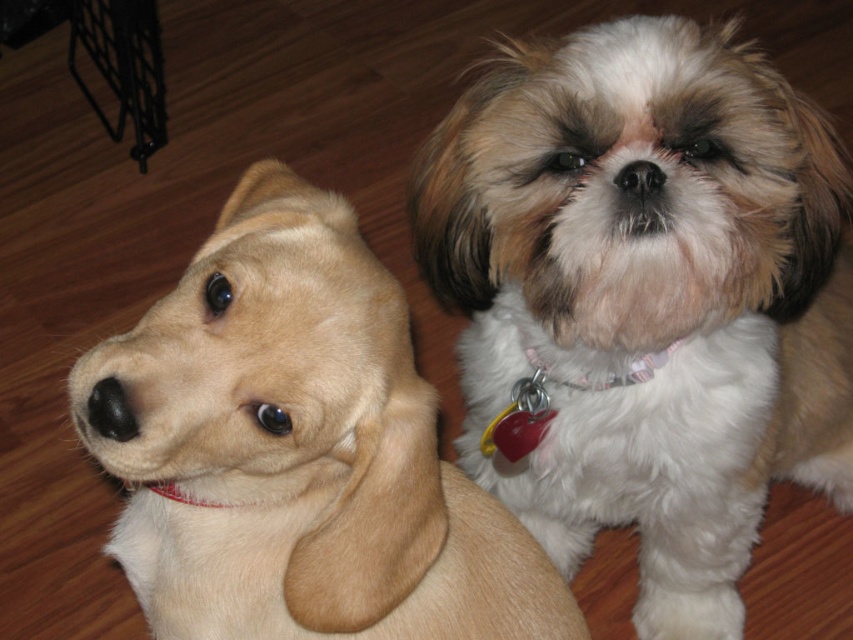
Can you confirm if pink fabric neckband at center is taller than black fur nose at center?

Indeed, pink fabric neckband at center has a greater height compared to black fur nose at center.

Is pink fabric neckband at center positioned at the back of black fur nose at center?

Yes, it is.

You are a GUI agent. You are given a task and a screenshot of the screen. Output one action in this format:
    pyautogui.click(x=<x>, y=<y>)
    Task: Click on the pink fabric neckband at center
    
    Given the screenshot: What is the action you would take?
    pyautogui.click(x=596, y=378)

Describe the element at coordinates (300, 451) in the screenshot. The height and width of the screenshot is (640, 853). I see `golden fur puppy at left` at that location.

Locate an element on the screen. The height and width of the screenshot is (640, 853). golden fur puppy at left is located at coordinates (300, 451).

Locate an element on the screen. golden fur puppy at left is located at coordinates (300, 451).

Is white fluffy dog at upper center smaller than black fur nose at center?

No, white fluffy dog at upper center is not smaller than black fur nose at center.

What do you see at coordinates (648, 296) in the screenshot?
I see `white fluffy dog at upper center` at bounding box center [648, 296].

I want to click on white fluffy dog at upper center, so click(648, 296).